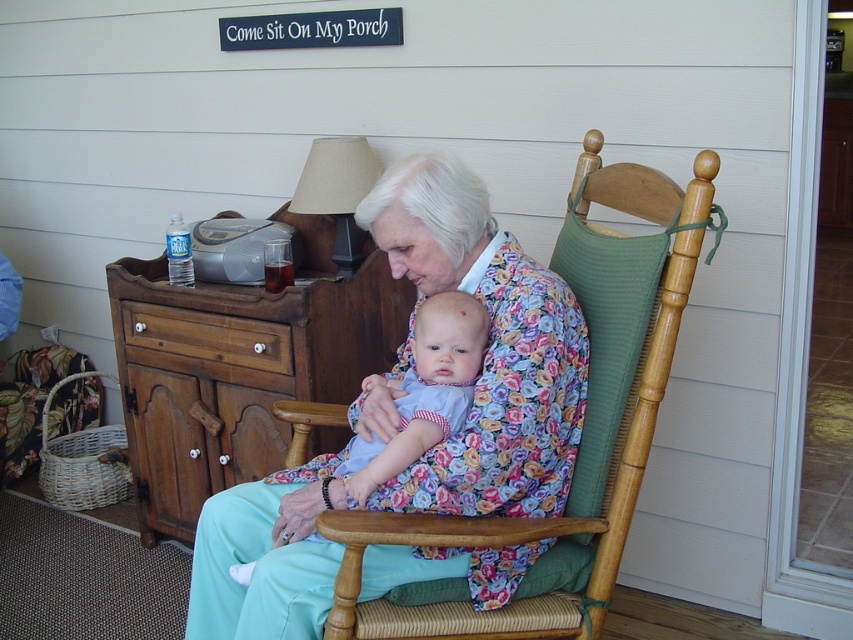
You are organizing a small party and need to place a 30 cm wide cake on the table. The floral fabric dress at center and brown wood dresser at left are on the table. Can the cake fit between them?

The floral fabric dress at center occupies less space than brown wood dresser at left, so there might be enough space between them for the cake. However, without knowing the exact distance between the two items, it is uncertain if the 30 cm wide cake will fit.

You are standing at the point labeled point (480, 256) and want to walk towards the point labeled point (282, 301). Which direction should you move?

You should move backward because point (480, 256) is in front of point (282, 301), so moving backward will take you toward the latter point.

Consider the image. You are a delivery person holding a package that requires a 1 meter clearance to pass through a doorway. You need to deliver it to the room where the woven wood armchair at center is located. Can you navigate through the doorway without tilting the package?

The distance of woven wood armchair at center from viewer is 1.27 meters. Since the required clearance is 1 meter and the distance is sufficient, you can navigate through the doorway without tilting the package.